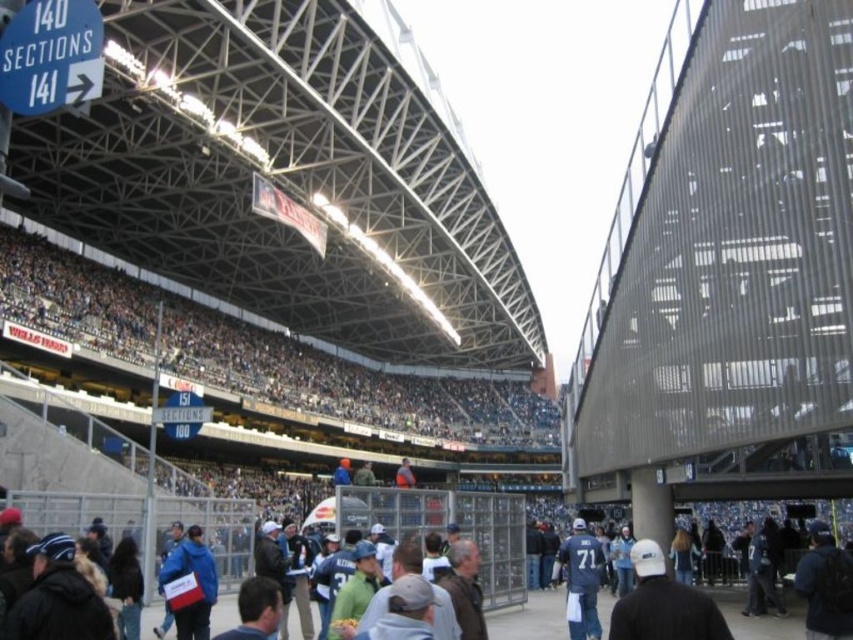
Does white cap at center have a smaller size compared to blue fabric jacket at lower left?

No, white cap at center is not smaller than blue fabric jacket at lower left.

Is white cap at center shorter than blue fabric jacket at lower left?

In fact, white cap at center may be taller than blue fabric jacket at lower left.

Who is more distant from viewer, (676,602) or (177,616)?

The point (177,616) is more distant.

Identify the location of white cap at center. This screenshot has width=853, height=640. (663, 604).

Is dark gray concrete crowd at center taller than blue fabric jacket at lower left?

Yes, dark gray concrete crowd at center is taller than blue fabric jacket at lower left.

Who is higher up, dark gray concrete crowd at center or blue fabric jacket at lower left?

dark gray concrete crowd at center is above.

Where is `dark gray concrete crowd at center`? dark gray concrete crowd at center is located at coordinates (351, 385).

Is dark gray concrete crowd at center closer to camera compared to white cap at center?

No, dark gray concrete crowd at center is behind white cap at center.

How distant is dark gray concrete crowd at center from white cap at center?

A distance of 201.80 feet exists between dark gray concrete crowd at center and white cap at center.

Is point (508, 422) positioned before point (659, 602)?

No, it is behind (659, 602).

Identify the location of dark gray concrete crowd at center. This screenshot has height=640, width=853. (351, 385).